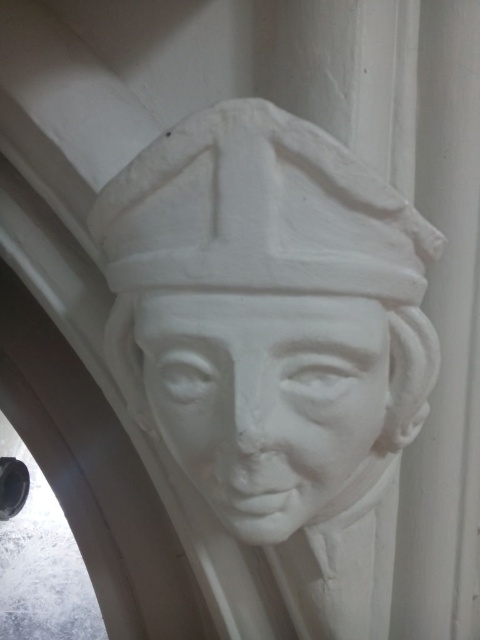
Question: Which point is farther from the camera taking this photo?

Choices:
 (A) (336, 346)
 (B) (252, 490)

Answer: (B)

Question: Can you confirm if white marble bust at center is positioned above white matte sculpture at center?

Choices:
 (A) yes
 (B) no

Answer: (A)

Question: In this image, where is white marble bust at center located relative to white matte sculpture at center?

Choices:
 (A) left
 (B) right

Answer: (A)

Question: Can you confirm if white marble bust at center is positioned below white matte sculpture at center?

Choices:
 (A) no
 (B) yes

Answer: (A)

Question: Which point appears closest to the camera in this image?

Choices:
 (A) (264, 502)
 (B) (139, 221)

Answer: (B)

Question: Which point is closer to the camera taking this photo?

Choices:
 (A) (204, 216)
 (B) (338, 387)

Answer: (A)